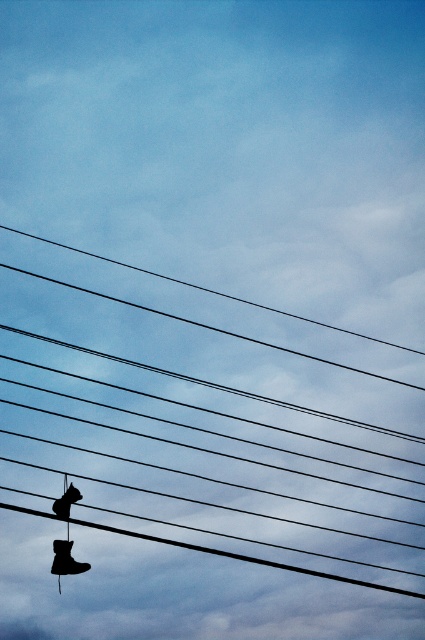
Is black wire at center further to camera compared to matte black shoe at lower left?

No, it is in front of matte black shoe at lower left.

This screenshot has height=640, width=425. Identify the location of black wire at center. (204, 429).

What are the coordinates of `black wire at center` in the screenshot? It's located at (204, 429).

Can you confirm if black rubber boot at lower left is wider than matte black shoe at lower left?

Indeed, black rubber boot at lower left has a greater width compared to matte black shoe at lower left.

This screenshot has height=640, width=425. What do you see at coordinates (65, 560) in the screenshot?
I see `black rubber boot at lower left` at bounding box center [65, 560].

This screenshot has width=425, height=640. I want to click on black rubber boot at lower left, so click(x=65, y=560).

Which is below, black wire at center or black rubber boot at lower left?

black rubber boot at lower left

Is black wire at center positioned in front of black rubber boot at lower left?

Yes, it is in front of black rubber boot at lower left.

Measure the distance between point (266,330) and camera.

The distance of point (266,330) from camera is 23.02 meters.

Locate an element on the screen. Image resolution: width=425 pixels, height=640 pixels. black wire at center is located at coordinates (204, 429).